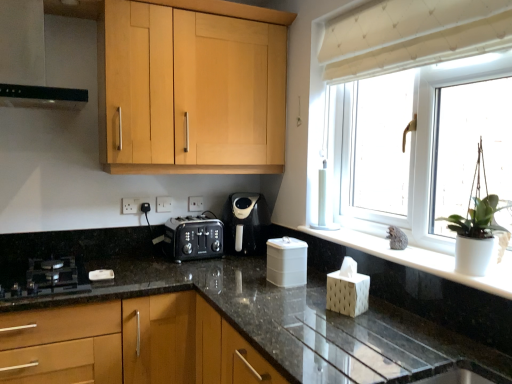
At what (x,y) coordinates should I click in order to perform the action: click on vacant region in front of white plastic electric outlet at center, the second electric outlet viewed from the front. Please return your answer as a coordinate pair (x, y). Image resolution: width=512 pixels, height=384 pixels. Looking at the image, I should click on (188, 220).